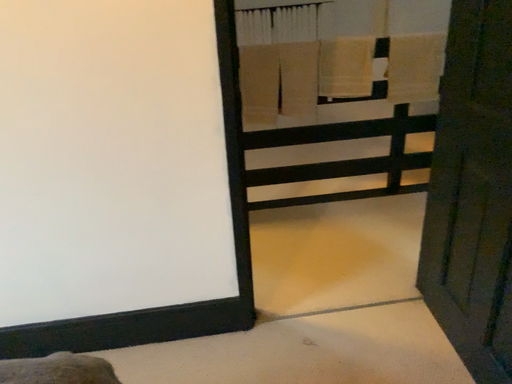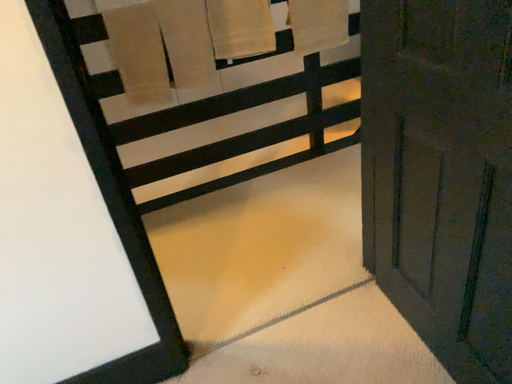
Question: Which way did the camera rotate in the video?

Choices:
 (A) rotated right
 (B) rotated left

Answer: (A)